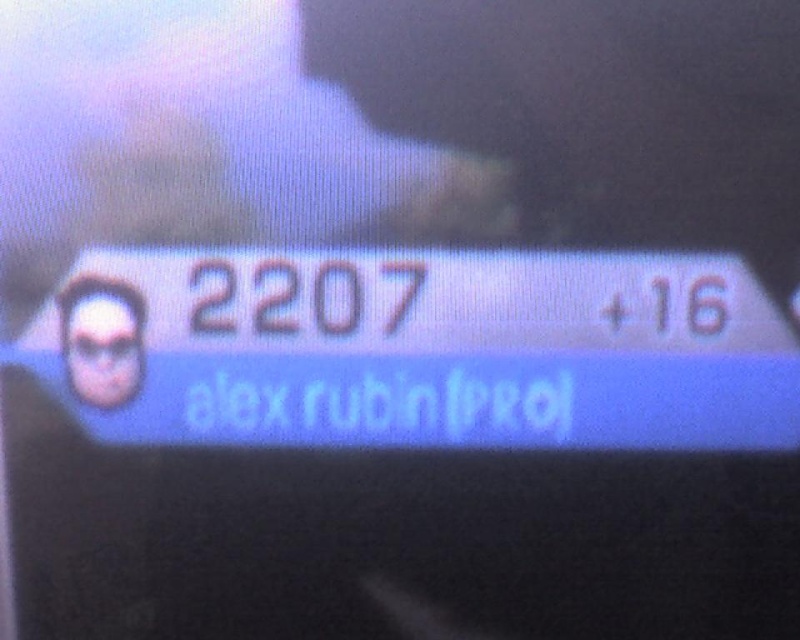
Looking at this image, you are a graphic designer reviewing a digital display. The display has the blue glossy text at center and the matte black sunglasses at left. Which object is closer to the viewer?

The blue glossy text at center is closer to the viewer because it is in front of the matte black sunglasses at left.

Looking at this image, you are a graphic designer reviewing a digital interface. You notice the blue glossy text at center and the matte black sunglasses at left. Which object is located to the right of the other?

The blue glossy text at center is positioned on the right side of matte black sunglasses at left.

You are a game developer analyzing a user interface. You see a point at coordinates (x=417, y=349). What does this point represent?

The point at (x=417, y=349) indicates blue glossy text at center.